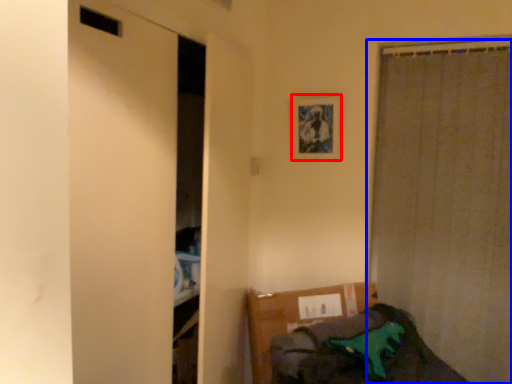
Question: Among these objects, which one is farthest to the camera, picture frame (highlighted by a red box) or curtain (highlighted by a blue box)?

Choices:
 (A) picture frame
 (B) curtain

Answer: (A)